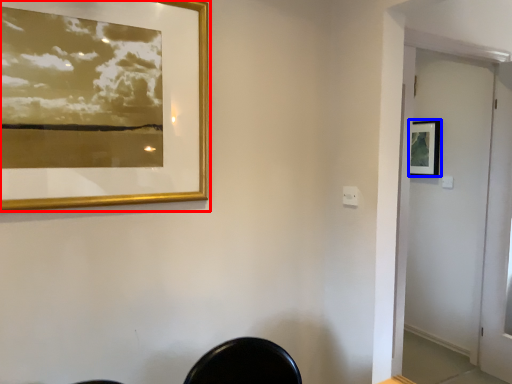
Question: Which object appears closest to the camera in this image, picture frame (highlighted by a red box) or picture frame (highlighted by a blue box)?

Choices:
 (A) picture frame
 (B) picture frame

Answer: (A)